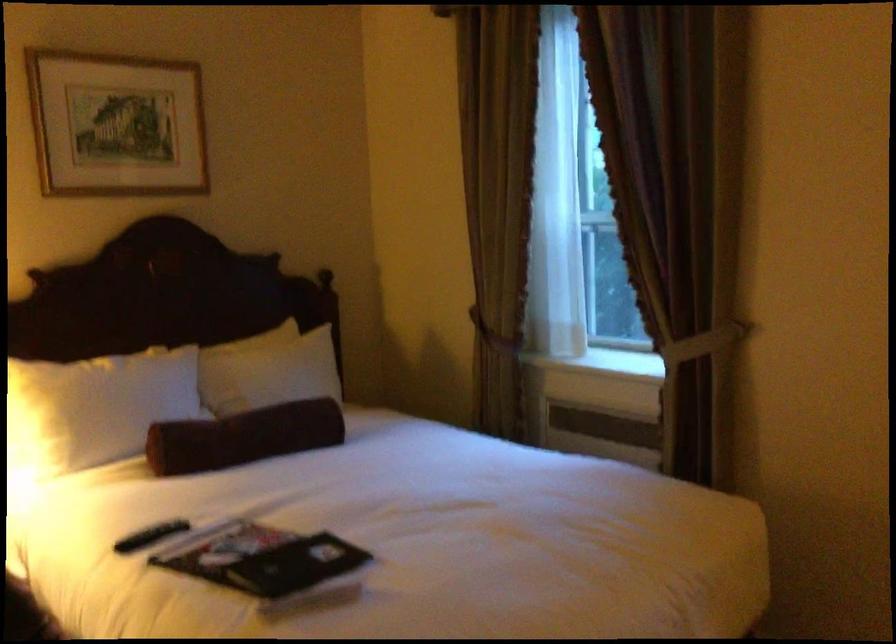
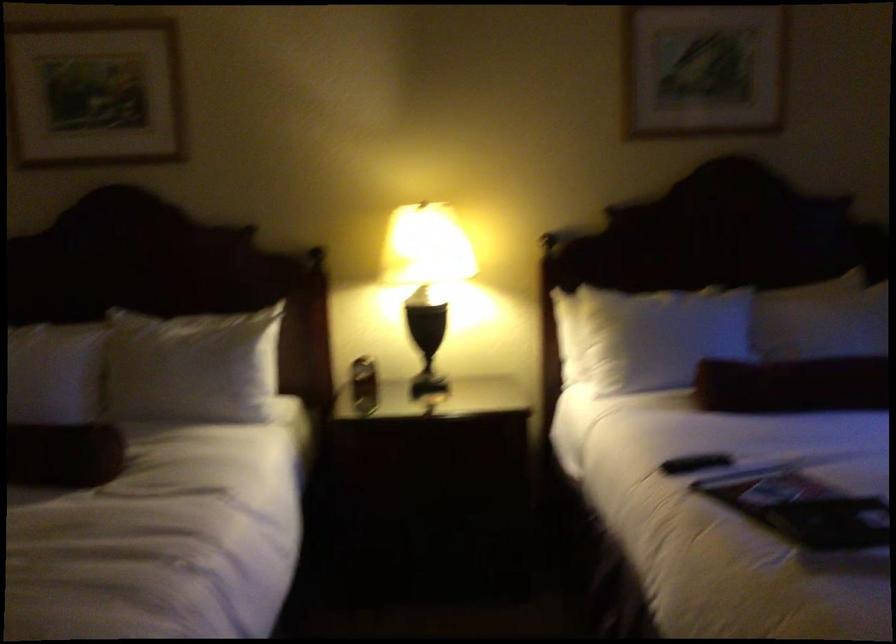
In the second image, find the point that corresponds to (240,438) in the first image.

(793, 384)